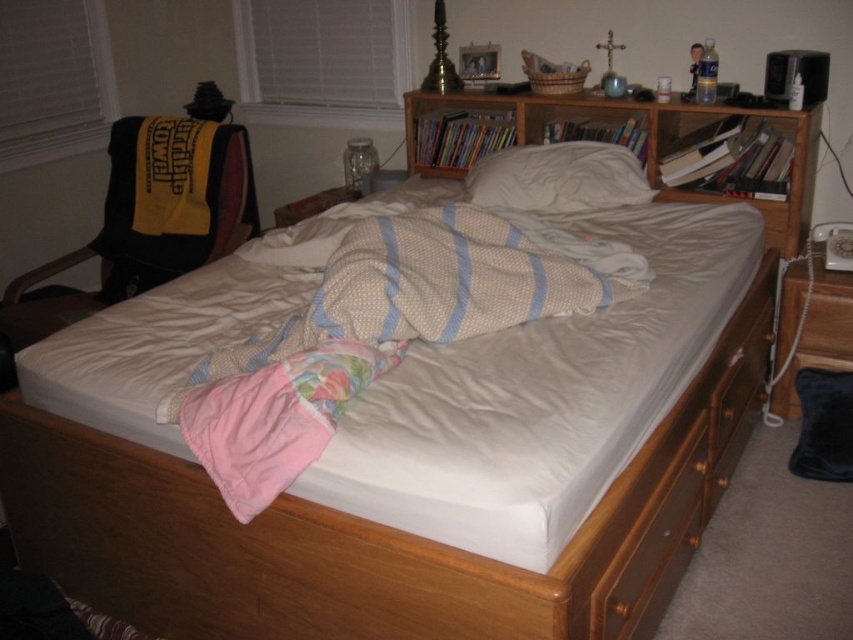
Question: Is wooden drawer at lower right thinner than white soft pillow at center?

Choices:
 (A) yes
 (B) no

Answer: (B)

Question: Can you confirm if wooden bookshelf at center is positioned to the left of white soft pillow at center?

Choices:
 (A) no
 (B) yes

Answer: (A)

Question: Among these points, which one is nearest to the camera?

Choices:
 (A) (793, 118)
 (B) (722, 332)

Answer: (B)

Question: Considering the real-world distances, which object is farthest from the white soft pillow at center?

Choices:
 (A) wooden drawer at lower right
 (B) wooden bookshelf at center

Answer: (A)

Question: Is wooden bookshelf at center in front of white soft pillow at center?

Choices:
 (A) no
 (B) yes

Answer: (B)

Question: Which of the following is the closest to the observer?

Choices:
 (A) wooden bookshelf at center
 (B) wooden drawer at lower right
 (C) white soft pillow at center

Answer: (B)